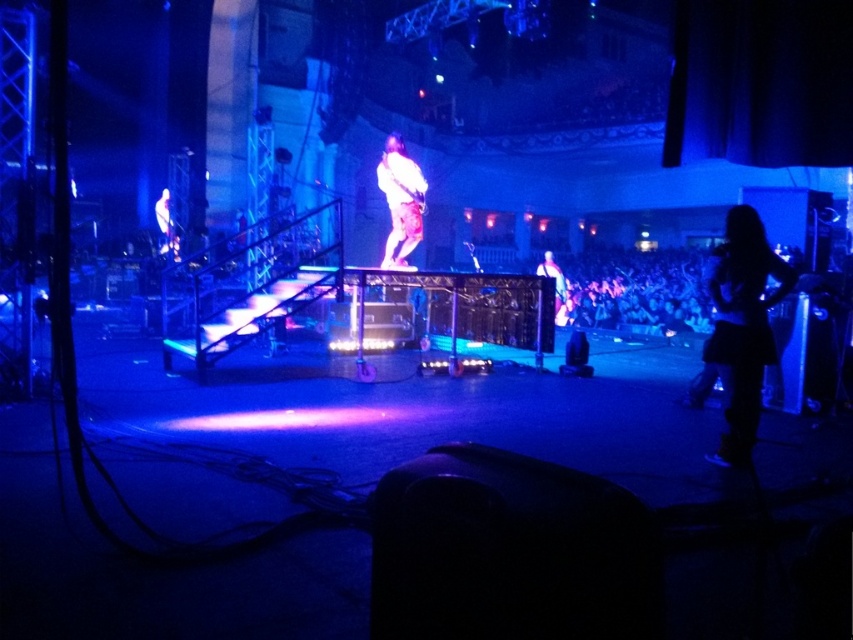
Does point (726, 227) lie behind point (556, 317)?

That is False.

Which is behind, point (744, 332) or point (564, 316)?

Point (564, 316)

Find the location of `black matte skirt at lower right`. black matte skirt at lower right is located at coordinates (741, 324).

Can you confirm if shiny purple guitar at center is positioned to the right of white fabric at upper left?

Yes, shiny purple guitar at center is to the right of white fabric at upper left.

Between point (407, 214) and point (167, 244), which one is positioned in front?

Point (407, 214) is more forward.

Locate an element on the screen. The width and height of the screenshot is (853, 640). shiny purple guitar at center is located at coordinates (399, 202).

Does shiny silver guitar at center have a smaller size compared to white fabric at upper left?

Incorrect, shiny silver guitar at center is not smaller in size than white fabric at upper left.

Does shiny silver guitar at center appear over white fabric at upper left?

No.

I want to click on shiny silver guitar at center, so click(x=555, y=285).